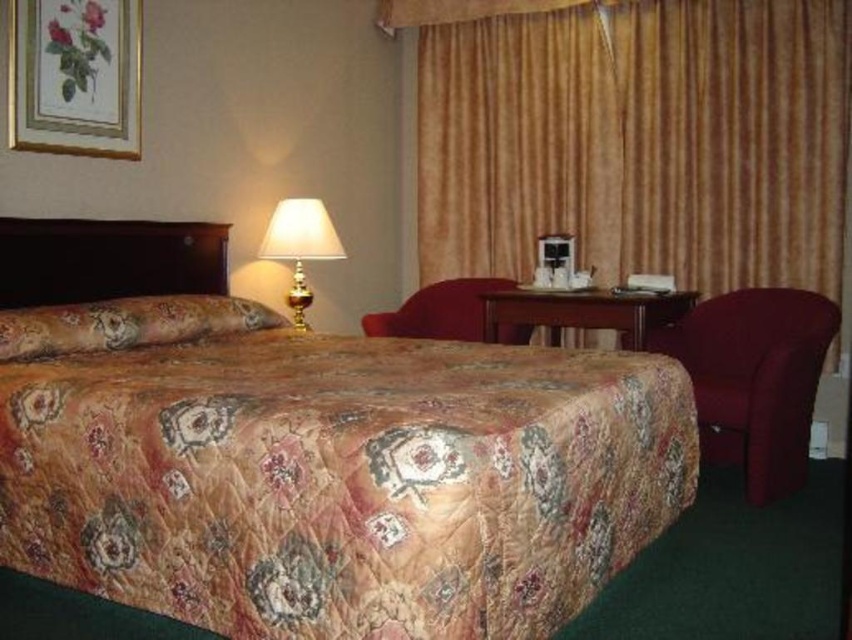
Question: Does velvet gold curtain at upper right have a greater width compared to velvet red armchair at center?

Choices:
 (A) no
 (B) yes

Answer: (B)

Question: Can you confirm if velvet gold curtain at upper right is smaller than velvet red armchair at center?

Choices:
 (A) yes
 (B) no

Answer: (B)

Question: Is velvet gold curtain at upper right bigger than gold metallic table lamp at upper center?

Choices:
 (A) no
 (B) yes

Answer: (B)

Question: Which object appears farthest from the camera in this image?

Choices:
 (A) velvet gold curtain at upper right
 (B) velvet red armchair at center

Answer: (B)

Question: Which point is farther from the camera taking this photo?

Choices:
 (A) (321, 211)
 (B) (827, 310)
 (C) (464, 296)
 (D) (507, 90)

Answer: (D)

Question: Estimate the real-world distances between objects in this image. Which object is farther from the velvet burgundy armchair at right?

Choices:
 (A) velvet gold curtain at upper right
 (B) velvet red armchair at center
 (C) gold metallic table lamp at upper center

Answer: (C)